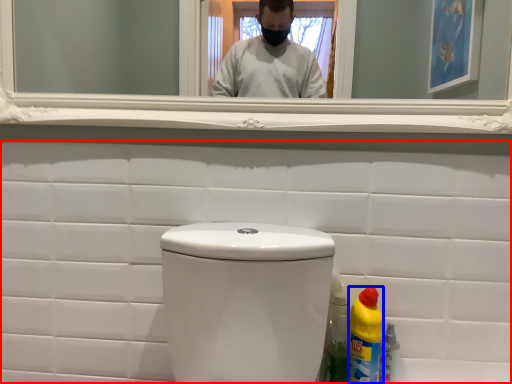
Question: Among these objects, which one is farthest to the camera, porcelain (highlighted by a red box) or bottle (highlighted by a blue box)?

Choices:
 (A) porcelain
 (B) bottle

Answer: (A)